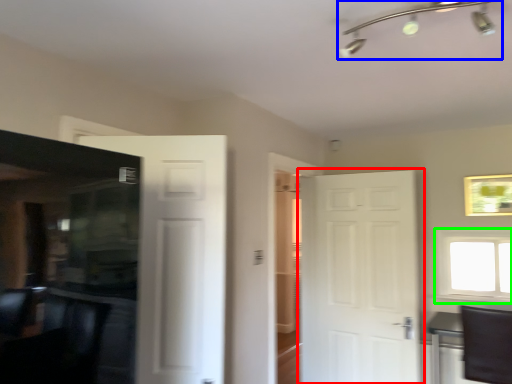
Question: Which object is the farthest from door (highlighted by a red box)? Choose among these: light fixture (highlighted by a blue box) or window (highlighted by a green box).

Choices:
 (A) light fixture
 (B) window

Answer: (A)